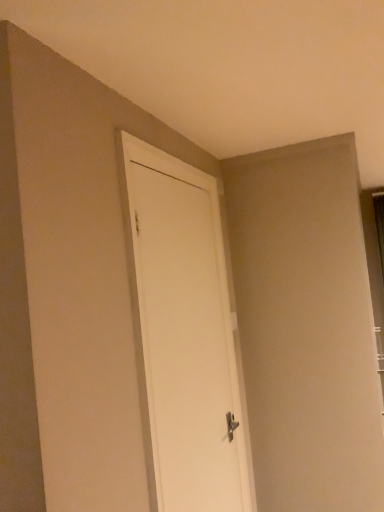
What do you see at coordinates (183, 334) in the screenshot? The height and width of the screenshot is (512, 384). I see `white matte door at center` at bounding box center [183, 334].

What is the approximate width of white matte door at center?

white matte door at center is 1.85 inches in width.

The image size is (384, 512). Find the location of `white matte door at center`. white matte door at center is located at coordinates (183, 334).

Find the location of `white matte door at center`. white matte door at center is located at coordinates (183, 334).